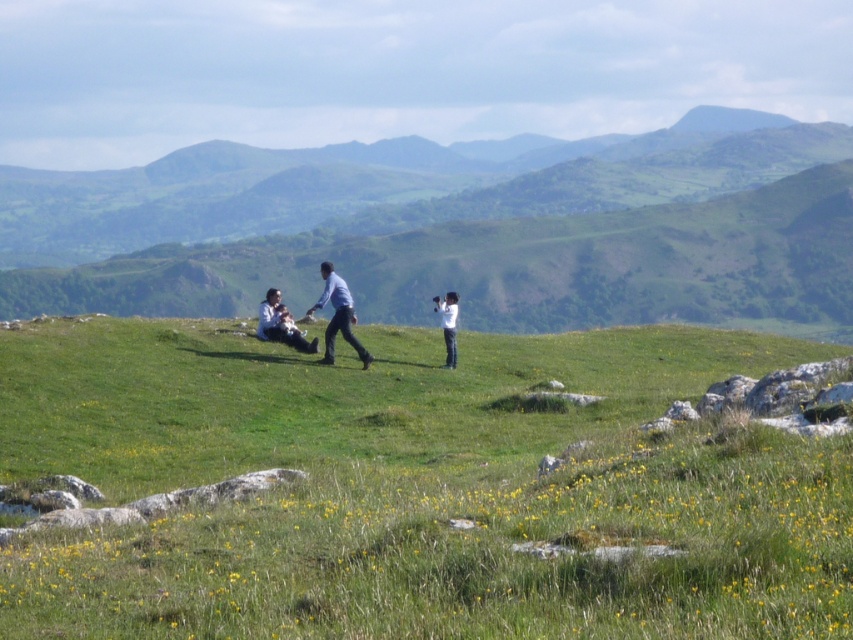
Question: Which of the following is the farthest from the observer?

Choices:
 (A) white matte camera at center
 (B) green grassy hillside at center
 (C) matte blue shirt at center

Answer: (B)

Question: Is matte blue shirt at center below white matte camera at center?

Choices:
 (A) yes
 (B) no

Answer: (A)

Question: Observing the image, what is the correct spatial positioning of green grassy hillside at center in reference to white matte camera at center?

Choices:
 (A) right
 (B) left

Answer: (A)

Question: Does matte blue shirt at center have a lesser width compared to light blue fabric at center?

Choices:
 (A) yes
 (B) no

Answer: (B)

Question: Which point is farther from the camera taking this photo?

Choices:
 (A) (402, 522)
 (B) (589, 240)

Answer: (B)

Question: Which point is farther from the camera taking this photo?

Choices:
 (A) (335, 291)
 (B) (279, 294)

Answer: (B)